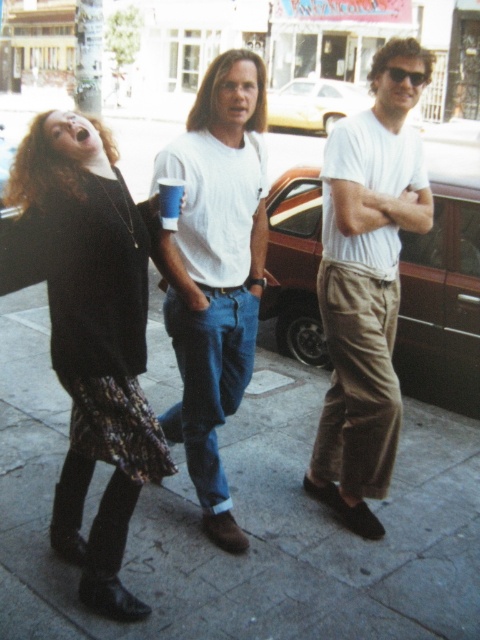
Question: Is white cotton t-shirt at center closer to the viewer compared to blue paper cup at center?

Choices:
 (A) yes
 (B) no

Answer: (B)

Question: Which object is positioned closest to the smooth concrete sidewalk at center?

Choices:
 (A) black knit sweater at left
 (B) floral skirt at center
 (C) blue paper cup at center
 (D) white cotton t-shirt at center

Answer: (B)

Question: Which object is closer to the camera taking this photo?

Choices:
 (A) floral skirt at center
 (B) white cotton t-shirt at center
 (C) blue paper cup at center
 (D) black knit sweater at left

Answer: (D)

Question: Is black knit sweater at left to the left of white cotton t-shirt at center from the viewer's perspective?

Choices:
 (A) no
 (B) yes

Answer: (B)

Question: Is floral skirt at center to the right of blue paper cup at center from the viewer's perspective?

Choices:
 (A) yes
 (B) no

Answer: (A)

Question: Which point is closer to the camera?

Choices:
 (A) (250, 115)
 (B) (179, 205)
 (C) (118, 461)
 (D) (392, 602)

Answer: (C)